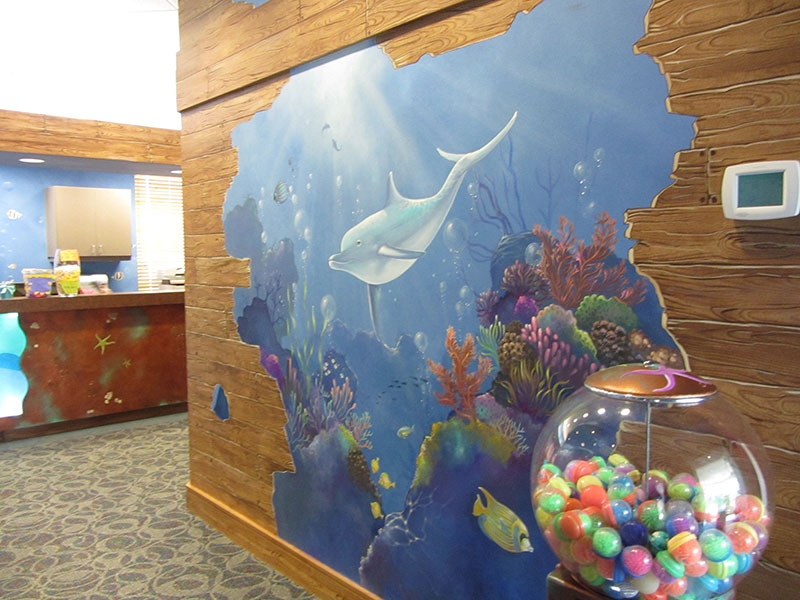
Locate an element on the screen. The width and height of the screenshot is (800, 600). lights is located at coordinates (178, 174), (36, 158).